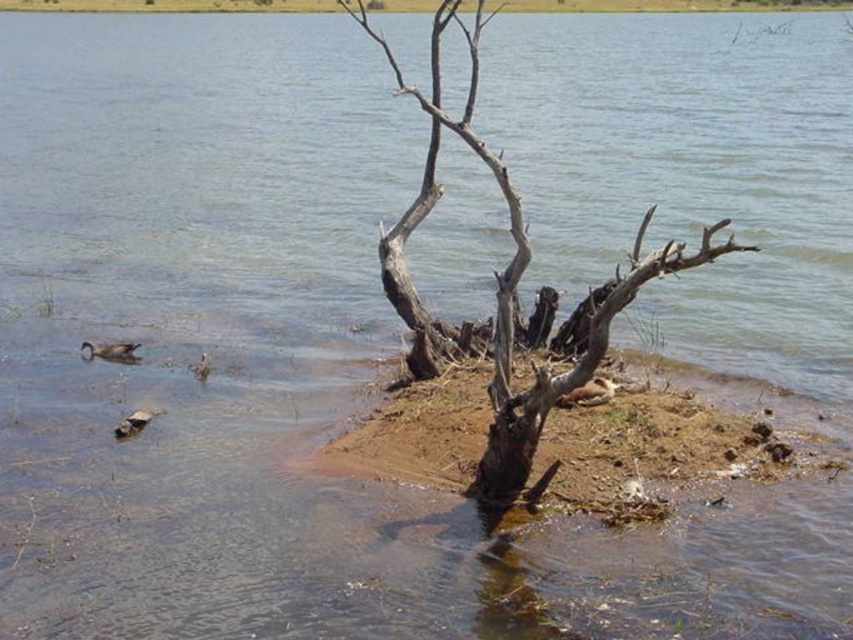
Between point (698, 483) and point (532, 428), which one is positioned in front?

Point (532, 428)

Does brown dirt shoreline at center have a lesser height compared to dead wood tree at center?

Yes.

Image resolution: width=853 pixels, height=640 pixels. What do you see at coordinates (659, 449) in the screenshot?
I see `brown dirt shoreline at center` at bounding box center [659, 449].

The image size is (853, 640). Identify the location of brown dirt shoreline at center. (659, 449).

Is brown fuzzy duck at lower left above brown feathered duck at center?

No.

Does brown fuzzy duck at lower left have a greater width compared to brown feathered duck at center?

Indeed, brown fuzzy duck at lower left has a greater width compared to brown feathered duck at center.

Does point (131, 417) lie behind point (204, 362)?

No, it is in front of (204, 362).

Image resolution: width=853 pixels, height=640 pixels. I want to click on brown fuzzy duck at lower left, so click(132, 422).

Is brown dirt shoreline at center taller than brown feathered duck at center?

Yes, brown dirt shoreline at center is taller than brown feathered duck at center.

From the picture: Who is higher up, brown dirt shoreline at center or brown feathered duck at center?

Positioned higher is brown feathered duck at center.

You are a GUI agent. You are given a task and a screenshot of the screen. Output one action in this format:
    pyautogui.click(x=<x>, y=<y>)
    Task: Click on the brown dirt shoreline at center
    
    Given the screenshot: What is the action you would take?
    pyautogui.click(x=659, y=449)

This screenshot has width=853, height=640. I want to click on brown dirt shoreline at center, so click(659, 449).